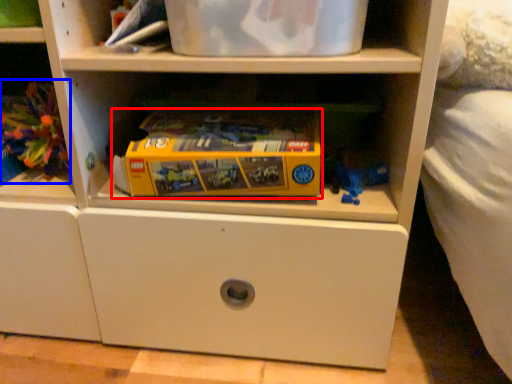
Question: Which of the following is the farthest to the observer, toy (highlighted by a red box) or toy (highlighted by a blue box)?

Choices:
 (A) toy
 (B) toy

Answer: (B)